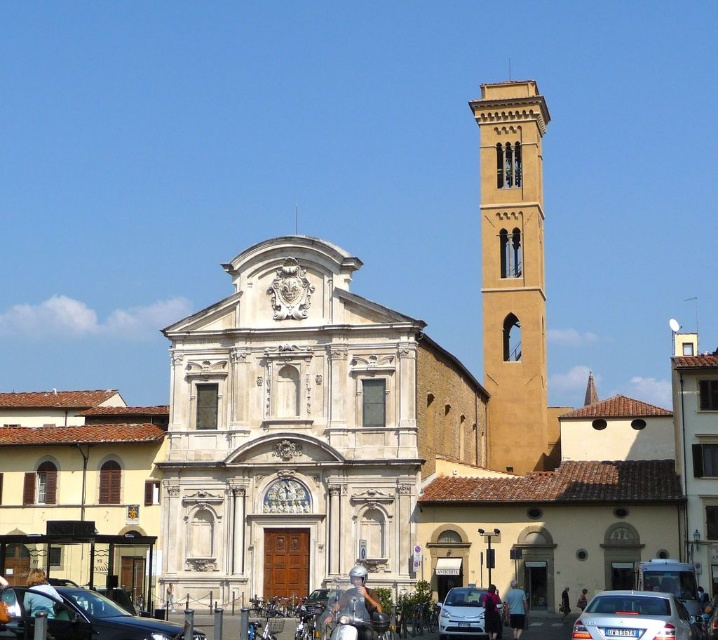
Identify the location of yellow stone bell tower at upper right. (513, 275).

Who is positioned more to the left, yellow stone bell tower at upper right or silver metallic car at lower center?

Positioned to the left is silver metallic car at lower center.

Locate an element on the screen. yellow stone bell tower at upper right is located at coordinates (513, 275).

Measure the distance between white marble church at center and silver metallic sedan at lower right.

white marble church at center is 59.47 feet away from silver metallic sedan at lower right.

How distant is white marble church at center from silver metallic sedan at lower right?

They are 18.13 meters apart.

Is point (391, 477) in front of point (640, 612)?

No, (391, 477) is behind (640, 612).

Identify the location of white marble church at center. The image size is (718, 640). tap(289, 432).

Is matte black car at lower left below silver metallic car at lower center?

Incorrect, matte black car at lower left is not positioned below silver metallic car at lower center.

Who is taller, matte black car at lower left or silver metallic car at lower center?

silver metallic car at lower center is taller.

Find the location of `matte black car at lower left`. matte black car at lower left is located at coordinates (78, 616).

Find the location of `matte black car at lower left`. matte black car at lower left is located at coordinates (78, 616).